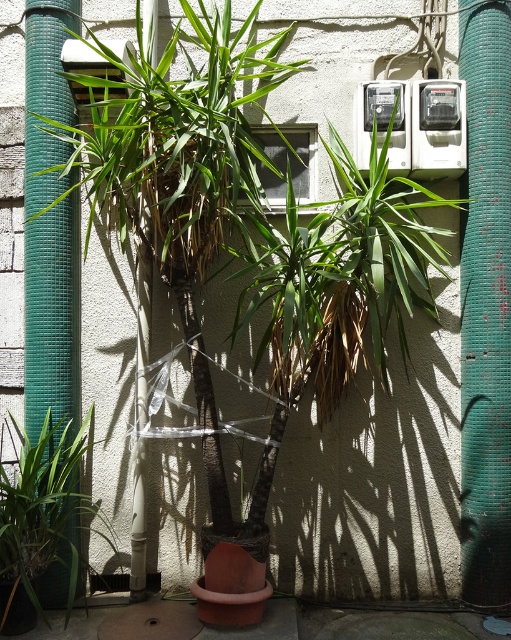
Is green mesh pipe at left smaller than green matte plant at lower left?

Indeed, green mesh pipe at left has a smaller size compared to green matte plant at lower left.

Does point (30, 154) lie behind point (12, 561)?

That is True.

Locate an element on the screen. green mesh pipe at left is located at coordinates (50, 227).